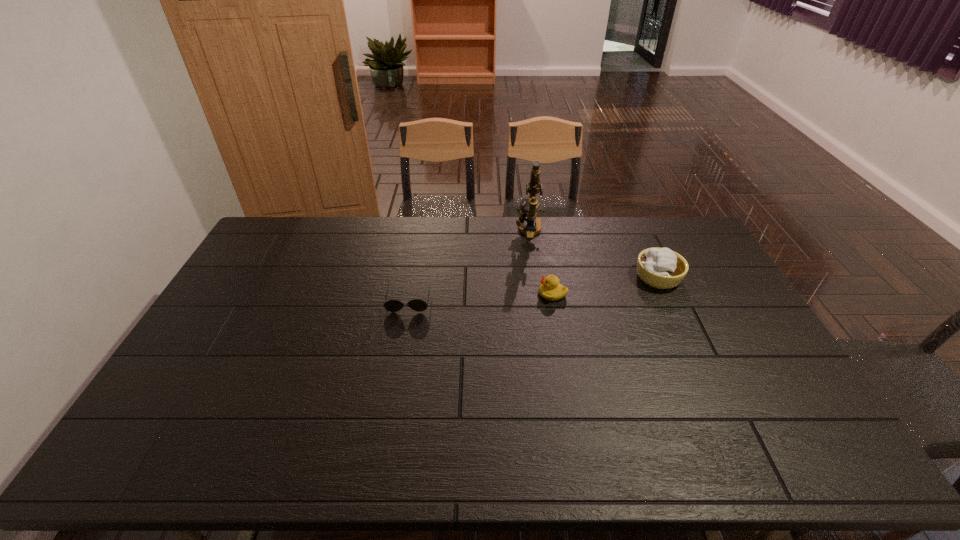
This screenshot has height=540, width=960. Find the location of `vacant area that lies between the duckling and the microscope`. vacant area that lies between the duckling and the microscope is located at coordinates (540, 262).

You are a GUI agent. You are given a task and a screenshot of the screen. Output one action in this format:
    pyautogui.click(x=<x>, y=<y>)
    Task: Click on the vacant point located between the rightmost object and the shortest object
    The height and width of the screenshot is (540, 960).
    Given the screenshot: What is the action you would take?
    pyautogui.click(x=534, y=289)

Where is `object that is the closest to the farthest object`? The width and height of the screenshot is (960, 540). object that is the closest to the farthest object is located at coordinates (550, 289).

Where is `the closest object to the microscope`? The height and width of the screenshot is (540, 960). the closest object to the microscope is located at coordinates [550, 289].

Locate an element on the screen. This screenshot has width=960, height=540. blank space that satisfies the following two spatial constraints: 1. on the front side of the rightmost object; 2. on the front-facing side of the duckling is located at coordinates (666, 294).

The width and height of the screenshot is (960, 540). What are the coordinates of `vacant space that satisfies the following two spatial constraints: 1. on the front-facing side of the duckling; 2. on the front-facing side of the sunglasses` in the screenshot? It's located at (554, 301).

Image resolution: width=960 pixels, height=540 pixels. What are the coordinates of `vacant area that satisfies the following two spatial constraints: 1. on the front-facing side of the second shortest object; 2. on the front-facing side of the shortest object` in the screenshot? It's located at (554, 301).

Locate an element on the screen. This screenshot has height=540, width=960. free region that satisfies the following two spatial constraints: 1. on the front side of the third shortest object; 2. on the left side of the tallest object is located at coordinates (536, 277).